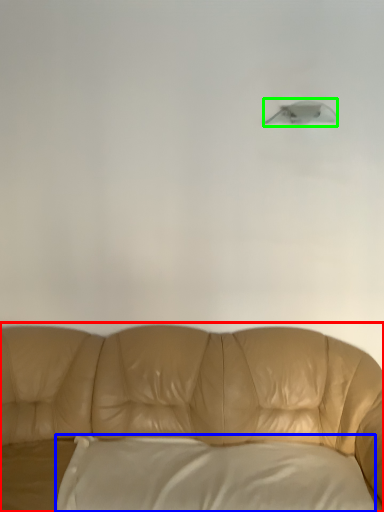
Question: Estimate the real-world distances between objects in this image. Which object is closer to studio couch (highlighted by a red box), pillow (highlighted by a blue box) or lamp (highlighted by a green box)?

Choices:
 (A) pillow
 (B) lamp

Answer: (A)